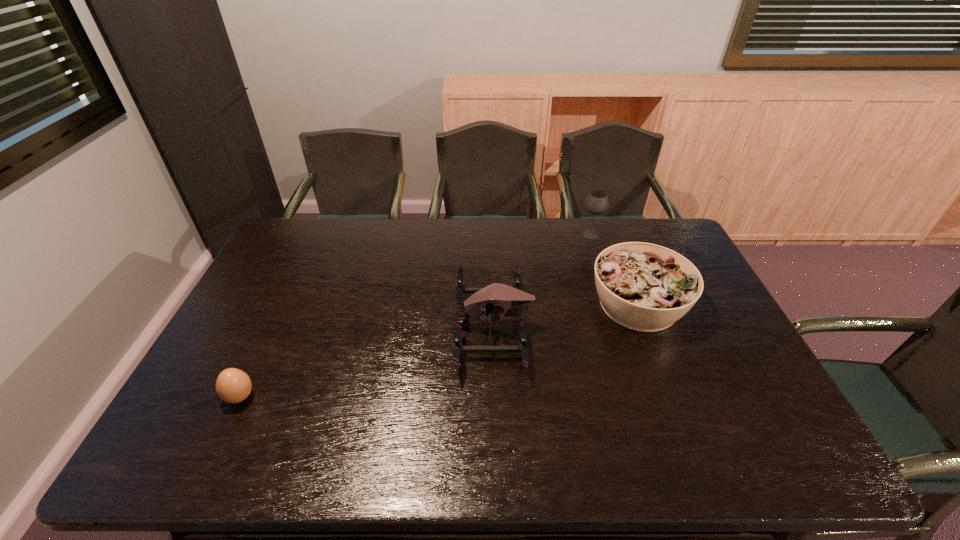
This screenshot has height=540, width=960. Identify the location of vacant area between the salad and the boiled egg. (439, 350).

Locate an element on the screen. empty location between the third object from right to left and the salad is located at coordinates (565, 315).

The image size is (960, 540). I want to click on free point between the third object from right to left and the salad, so click(x=565, y=315).

Find the location of `vacant space that is in between the tallest object and the leftmost object`. vacant space that is in between the tallest object and the leftmost object is located at coordinates (416, 315).

The width and height of the screenshot is (960, 540). What are the coordinates of `free space that is in between the farthest object and the boiled egg` in the screenshot? It's located at (416, 315).

Where is `free space between the farthest object and the drone`? free space between the farthest object and the drone is located at coordinates (542, 280).

The image size is (960, 540). In order to click on free space between the salad and the shortest object in this screenshot , I will do `click(439, 350)`.

Where is `unoccupied position between the salad and the drone`? This screenshot has width=960, height=540. unoccupied position between the salad and the drone is located at coordinates (565, 315).

You are a GUI agent. You are given a task and a screenshot of the screen. Output one action in this format:
    pyautogui.click(x=<x>, y=<y>)
    Task: Click on the free space between the second object from left to right and the tallest object
    The height and width of the screenshot is (540, 960).
    Given the screenshot: What is the action you would take?
    pyautogui.click(x=542, y=280)

At what (x,y) coordinates should I click in order to perform the action: click on object that can be found as the third closest to the shortest object. Please return your answer as a coordinate pair (x, y). The image size is (960, 540). Looking at the image, I should click on (596, 202).